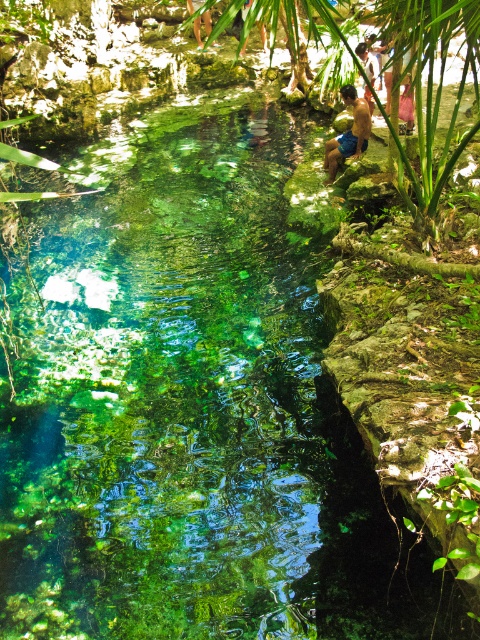
Is blue denim shorts at upper right taller than smooth skin person at upper center?

No, blue denim shorts at upper right is not taller than smooth skin person at upper center.

Is the position of blue denim shorts at upper right less distant than that of smooth skin person at upper center?

That is False.

Locate an element on the screen. This screenshot has width=480, height=640. blue denim shorts at upper right is located at coordinates (348, 132).

Between blue denim shorts at upper right and brown textured shirt at upper center, which one has more height?

With more height is blue denim shorts at upper right.

I want to click on blue denim shorts at upper right, so click(x=348, y=132).

I want to click on blue denim shorts at upper right, so click(348, 132).

This screenshot has height=640, width=480. In order to click on blue denim shorts at upper right in this screenshot , I will do `click(348, 132)`.

Does brown textured shirt at upper center lie in front of smooth skin person at upper center?

No, brown textured shirt at upper center is further to the viewer.

Find the location of a particular element. brown textured shirt at upper center is located at coordinates (365, 61).